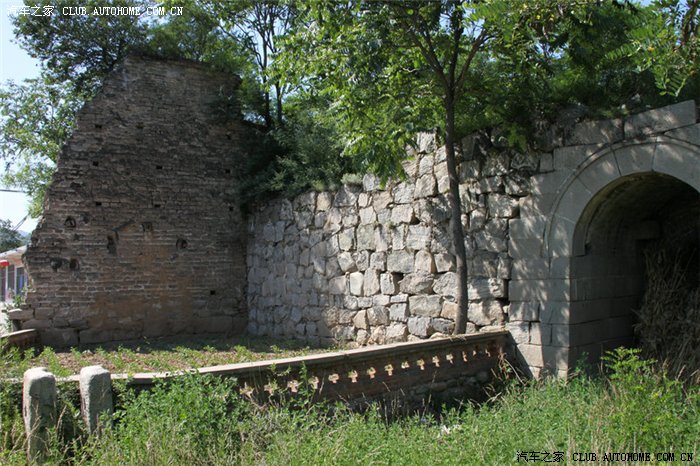
The image size is (700, 466). Identify the location of arched opening in stone wall, center right side. (621, 266), (640, 221), (662, 311), (677, 197), (598, 331).